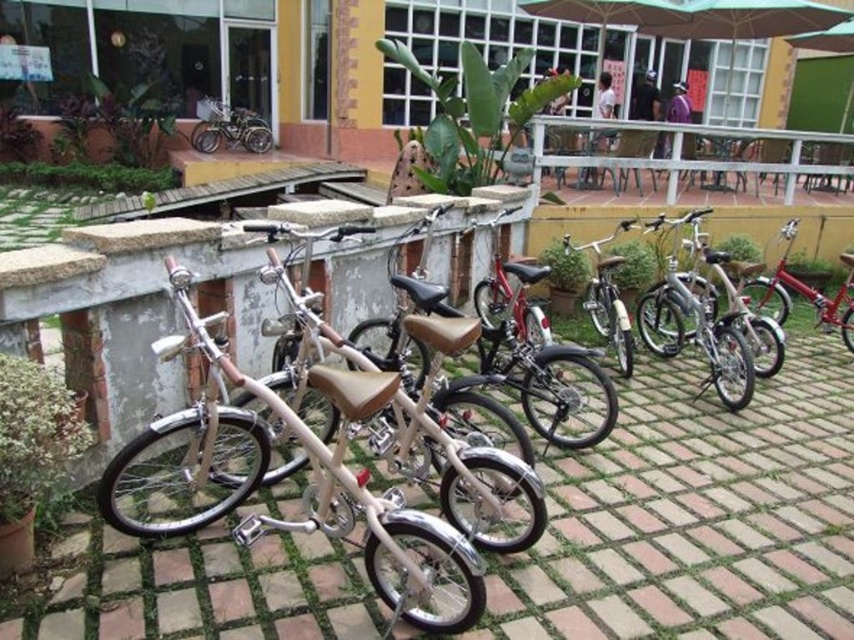
Does matte beige bicycle at center appear on the right side of silver metallic bicycle at upper left?

Yes, matte beige bicycle at center is to the right of silver metallic bicycle at upper left.

From the picture: Who is more forward, (340,532) or (249,125)?

Positioned in front is point (340,532).

What do you see at coordinates (308, 484) in the screenshot? I see `matte beige bicycle at center` at bounding box center [308, 484].

Locate an element on the screen. matte beige bicycle at center is located at coordinates point(308,484).

Between point (838, 326) and point (212, 108), which one is positioned behind?

Point (212, 108)

How far apart are shiny silver bicycle at center and silver metallic bicycle at upper left?

shiny silver bicycle at center is 10.85 meters away from silver metallic bicycle at upper left.

The image size is (854, 640). I want to click on shiny silver bicycle at center, so click(805, 292).

Between point (197, 472) and point (782, 228), which one is positioned in front?

Point (197, 472) is in front.

Is the position of matte beige bicycle at center less distant than that of shiny silver bicycle at center?

Yes, matte beige bicycle at center is in front of shiny silver bicycle at center.

Locate an element on the screen. This screenshot has width=854, height=640. matte beige bicycle at center is located at coordinates (308, 484).

Where is `matte beige bicycle at center`? The width and height of the screenshot is (854, 640). matte beige bicycle at center is located at coordinates (308, 484).